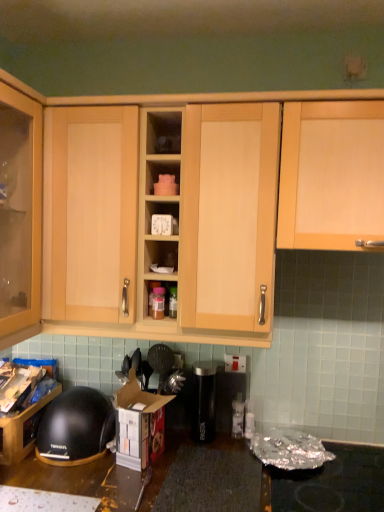
Question: Based on their positions, is light wood cabinet door at upper right, the 3th cabinetry from the left, located to the left or right of light wood cabinet at center, the second cabinetry when ordered from right to left?

Choices:
 (A) right
 (B) left

Answer: (A)

Question: Is light wood cabinet door at upper right, the 3th cabinetry from the left, in front of or behind light wood cabinet at center, the second cabinetry when ordered from right to left, in the image?

Choices:
 (A) behind
 (B) front

Answer: (B)

Question: Considering the real-world distances, which object is farthest from the white cardboard box at lower center?

Choices:
 (A) black plastic water filter at center, the second appliance viewed from the left
 (B) black plastic bowl at lower left, which is the third cabinetry from right to left
 (C) light wood cabinet at center, the second cabinetry when ordered from right to left
 (D) black plastic canister at center, which ranks as the 2th appliance in right-to-left order
 (E) matte wood cabinet at center

Answer: (C)

Question: Estimate the real-world distances between objects in this image. Which object is farther from the black plastic canister at center, which appears as the first appliance when viewed from the left?

Choices:
 (A) black matte helmet at lower left
 (B) white cardboard box at lower center
 (C) light wood cabinet door at upper right, the 3th cabinetry from the left
 (D) matte wood cabinet at center
 (E) black plastic water filter at center, which is the first appliance from right to left

Answer: (D)